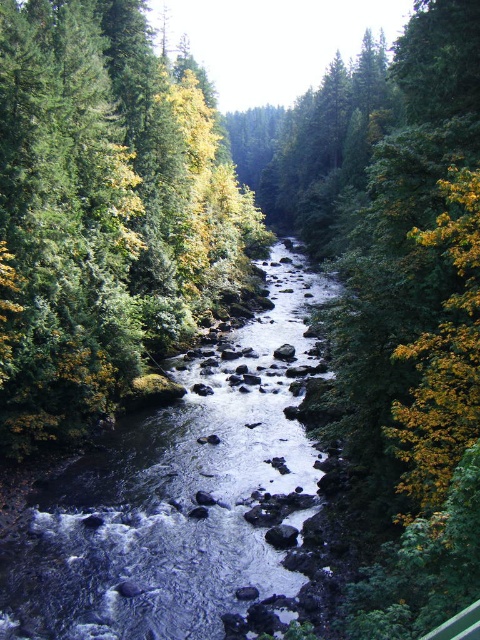
You are planning to cross the river using a small raft that can only carry items up to the width of the clear water at center. Can the raft fit through the space between the green matte tree at center and the nearest bank?

The green matte tree at center is wider than the clear water at center, so the space between the tree and the bank may be narrower than the raft can handle. It might not fit safely.

Looking at this image, you are a hiker trying to cross the river using the green matte tree at center and the clear water at center as landmarks. Which landmark should you approach first if you want to cross the river from the left side of the scene?

The green matte tree at center is positioned on the left side of clear water at center, so you should approach the green matte tree at center first before reaching the clear water at center.